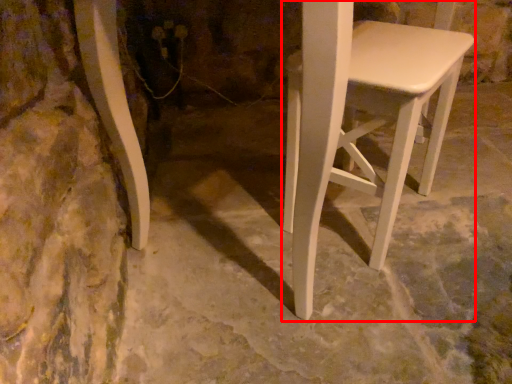
Question: From the image, what is the correct spatial relationship of stool (annotated by the red box) in relation to concrete?

Choices:
 (A) right
 (B) left

Answer: (B)